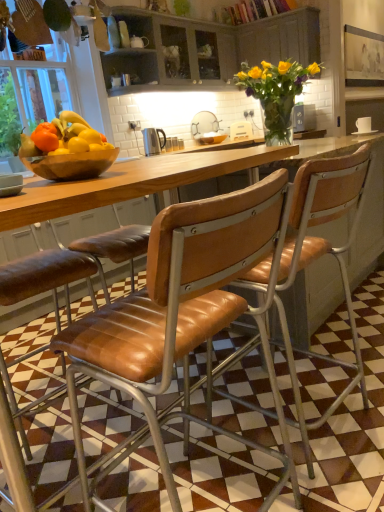
Question: From a real-world perspective, is matte gray cabinet at upper center, placed as the 2th cabinetry when sorted from right to left, over wooden cabinet at upper center, the 1th cabinetry from the right?

Choices:
 (A) yes
 (B) no

Answer: (A)

Question: Is wooden cabinet at upper center, the 1th cabinetry from the right, at the back of matte gray cabinet at upper center, placed as the 2th cabinetry when sorted from right to left?

Choices:
 (A) yes
 (B) no

Answer: (B)

Question: From the image's perspective, is matte gray cabinet at upper center, positioned as the 1th cabinetry in left-to-right order, under wooden cabinet at upper center, the 1th cabinetry from the right?

Choices:
 (A) yes
 (B) no

Answer: (A)

Question: Is matte gray cabinet at upper center, positioned as the 1th cabinetry in left-to-right order, touching wooden cabinet at upper center, placed as the 2th cabinetry when sorted from left to right?

Choices:
 (A) no
 (B) yes

Answer: (A)

Question: Is matte gray cabinet at upper center, positioned as the 1th cabinetry in left-to-right order, wider than wooden cabinet at upper center, the 1th cabinetry from the right?

Choices:
 (A) no
 (B) yes

Answer: (B)

Question: Is wooden bowl at center, which appears as the 2th bowl when viewed from the back, wider or thinner than satin silver kettle at center?

Choices:
 (A) thin
 (B) wide

Answer: (B)

Question: From a real-world perspective, is wooden bowl at center, which ranks as the second bowl in right-to-left order, physically located above or below satin silver kettle at center?

Choices:
 (A) below
 (B) above

Answer: (A)

Question: In the image, is wooden bowl at center, which is the 1th bowl from left to right, positioned in front of or behind satin silver kettle at center?

Choices:
 (A) behind
 (B) front

Answer: (B)

Question: Considering the relative positions of wooden bowl at center, which appears as the 2th bowl when viewed from the back, and satin silver kettle at center in the image provided, is wooden bowl at center, which appears as the 2th bowl when viewed from the back, to the left or to the right of satin silver kettle at center?

Choices:
 (A) right
 (B) left

Answer: (B)

Question: Considering the positions of point (276, 276) and point (18, 7), is point (276, 276) closer or farther from the camera than point (18, 7)?

Choices:
 (A) closer
 (B) farther

Answer: (A)

Question: Visually, is leather seat at center, acting as the second chair starting from the left, positioned to the left or to the right of wooden bowl at left?

Choices:
 (A) left
 (B) right

Answer: (B)

Question: From the image's perspective, relative to wooden bowl at left, is leather seat at center, the 1th chair when ordered from right to left, above or below?

Choices:
 (A) above
 (B) below

Answer: (B)

Question: Do you think leather seat at center, the 1th chair when ordered from right to left, is within wooden bowl at left, or outside of it?

Choices:
 (A) inside
 (B) outside

Answer: (B)

Question: Is matte brown bowl at center, placed as the 2th bowl when sorted from bottom to top, taller or shorter than leather seat at center, acting as the second chair starting from the left?

Choices:
 (A) short
 (B) tall

Answer: (A)

Question: Relative to leather seat at center, the 1th chair when ordered from right to left, is matte brown bowl at center, marked as the 1th bowl in a right-to-left arrangement, in front or behind?

Choices:
 (A) front
 (B) behind

Answer: (B)